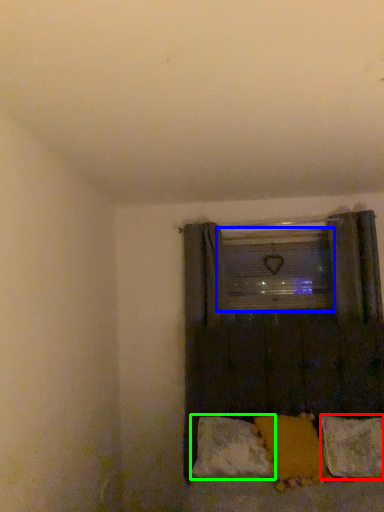
Question: Which object is the farthest from pillow (highlighted by a red box)? Choose among these: window screen (highlighted by a blue box) or pillow (highlighted by a green box).

Choices:
 (A) window screen
 (B) pillow

Answer: (A)